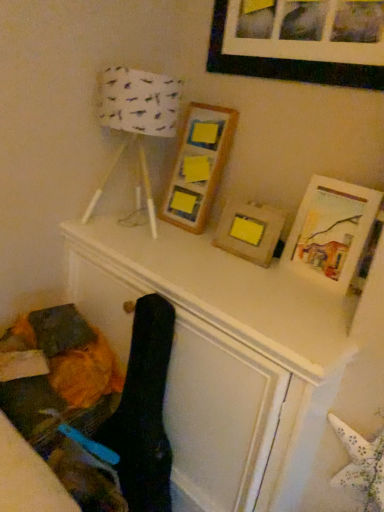
Question: Is wooden frame at center, which appears as the second picture frame when viewed from the top, bigger or smaller than matte wooden picture frame at upper right, arranged as the 4th picture frame when viewed from the top?

Choices:
 (A) big
 (B) small

Answer: (A)

Question: In terms of height, does wooden frame at center, the 3th picture frame positioned from the bottom, look taller or shorter compared to matte wooden picture frame at upper right, positioned as the 1th picture frame in bottom-to-top order?

Choices:
 (A) tall
 (B) short

Answer: (A)

Question: Estimate the real-world distances between objects in this image. Which object is farther from the wooden frame at center, which appears as the second picture frame when viewed from the top?

Choices:
 (A) matte wooden picture frame at upper right, arranged as the 4th picture frame when viewed from the top
 (B) black matte picture frame at upper center, placed as the 4th picture frame when sorted from bottom to top
 (C) wooden picture frame at center, which is the second picture frame in bottom-to-top order
 (D) white paper lampshade at upper left

Answer: (A)

Question: Which object is positioned farthest from the wooden frame at center, the 3th picture frame positioned from the bottom?

Choices:
 (A) black matte picture frame at upper center, placed as the 4th picture frame when sorted from bottom to top
 (B) white paper lampshade at upper left
 (C) matte wooden picture frame at upper right, positioned as the 1th picture frame in bottom-to-top order
 (D) wooden picture frame at center, which is the second picture frame in bottom-to-top order

Answer: (C)